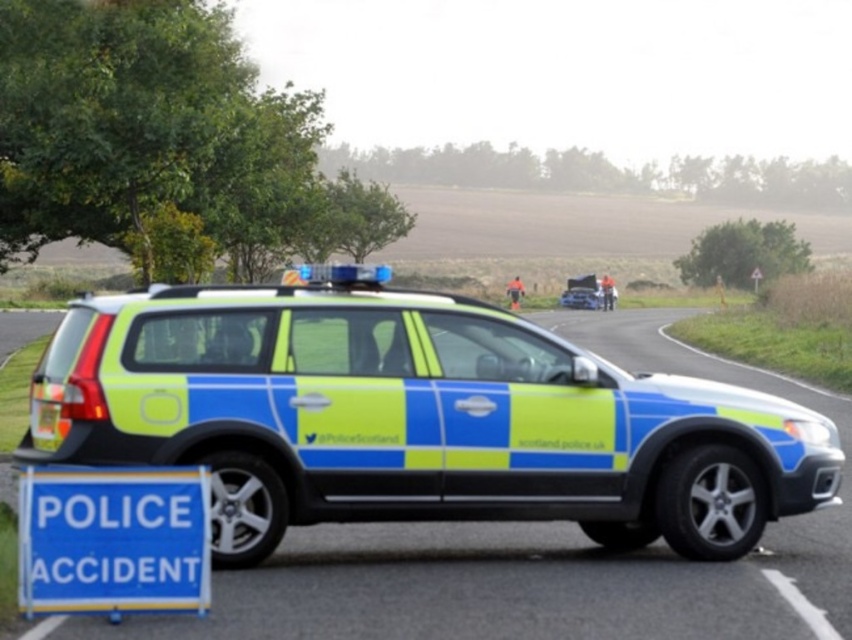
Is matte metallic police car at center thinner than blue plastic sign at lower left?

Indeed, matte metallic police car at center has a lesser width compared to blue plastic sign at lower left.

Between matte metallic police car at center and blue plastic sign at lower left, which one appears on the left side from the viewer's perspective?

From the viewer's perspective, blue plastic sign at lower left appears more on the left side.

Does point (533, 458) come closer to viewer compared to point (19, 481)?

No, (533, 458) is further to viewer.

Find the location of a particular element. The width and height of the screenshot is (852, 640). matte metallic police car at center is located at coordinates (413, 419).

Consider the image. Can you confirm if matte metallic police car at center is taller than neon green plastic police car at center?

No.

The height and width of the screenshot is (640, 852). What do you see at coordinates (413, 419) in the screenshot?
I see `matte metallic police car at center` at bounding box center [413, 419].

Locate an element on the screen. The image size is (852, 640). matte metallic police car at center is located at coordinates (413, 419).

Between point (427, 312) and point (580, 291), which one is positioned in front?

Positioned in front is point (427, 312).

In the scene shown: Between matte metallic police car at center and metallic silver car at center, which one is positioned higher?

metallic silver car at center

Based on the photo, measure the distance between point (717, 412) and camera.

They are 24.73 feet apart.

Where is `matte metallic police car at center`? The image size is (852, 640). matte metallic police car at center is located at coordinates (413, 419).